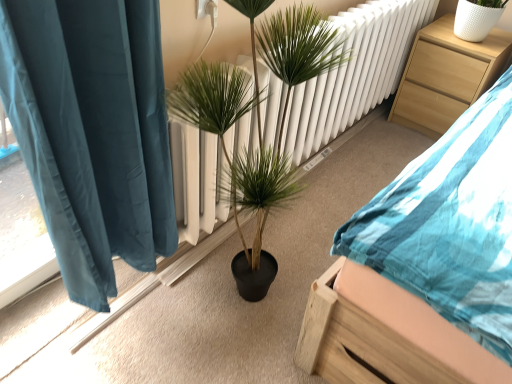
Question: Based on their positions, is wooden bed at center located to the left or right of light wood nightstand at upper right?

Choices:
 (A) right
 (B) left

Answer: (B)

Question: In terms of height, does wooden bed at center look taller or shorter compared to light wood nightstand at upper right?

Choices:
 (A) short
 (B) tall

Answer: (B)

Question: Which object is positioned farthest from the wooden bed at center?

Choices:
 (A) green leafy plant at center
 (B) light wood nightstand at upper right

Answer: (B)

Question: Estimate the real-world distances between objects in this image. Which object is farther from the green leafy plant at center?

Choices:
 (A) wooden bed at center
 (B) light wood nightstand at upper right

Answer: (B)